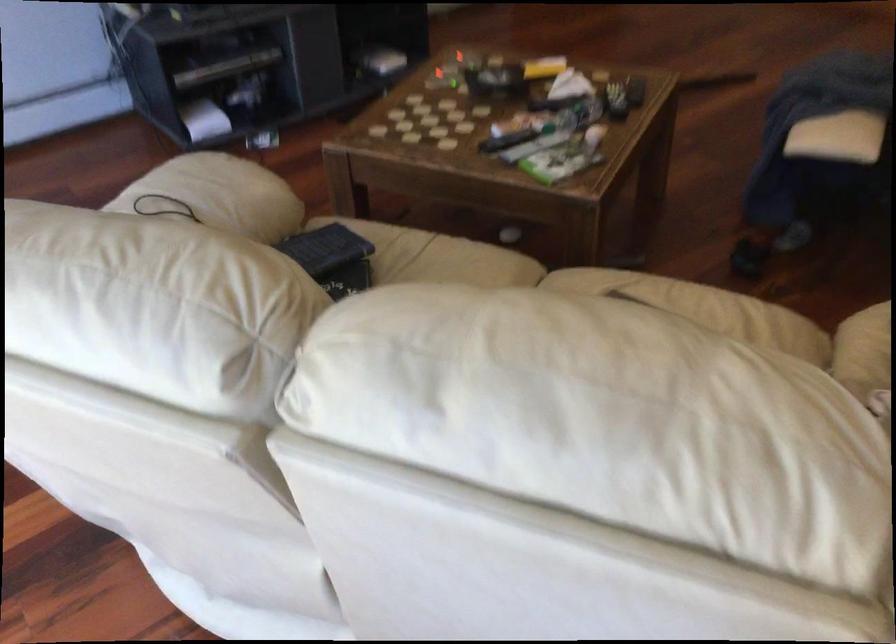
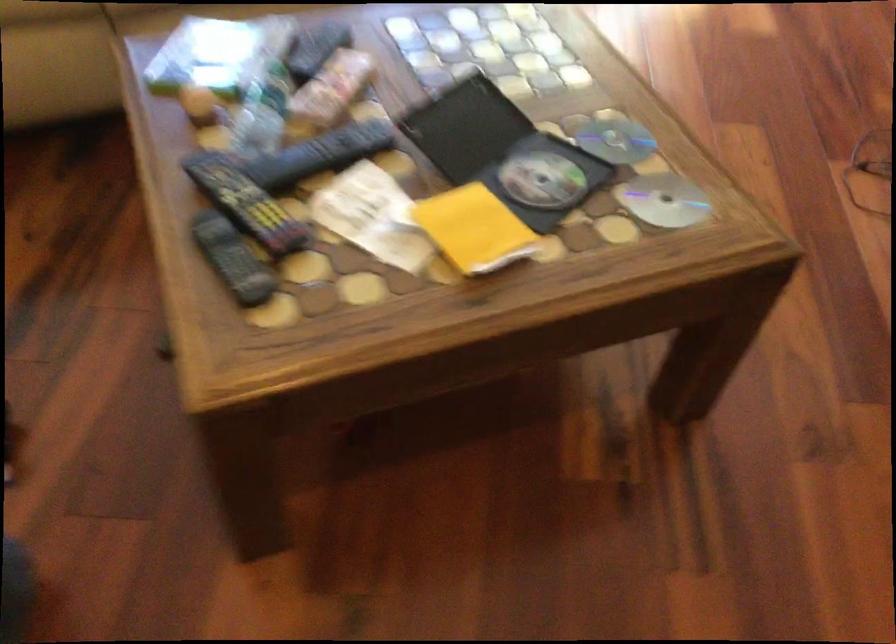
Locate, in the second image, the point that corresponds to (495,71) in the first image.

(541, 180)